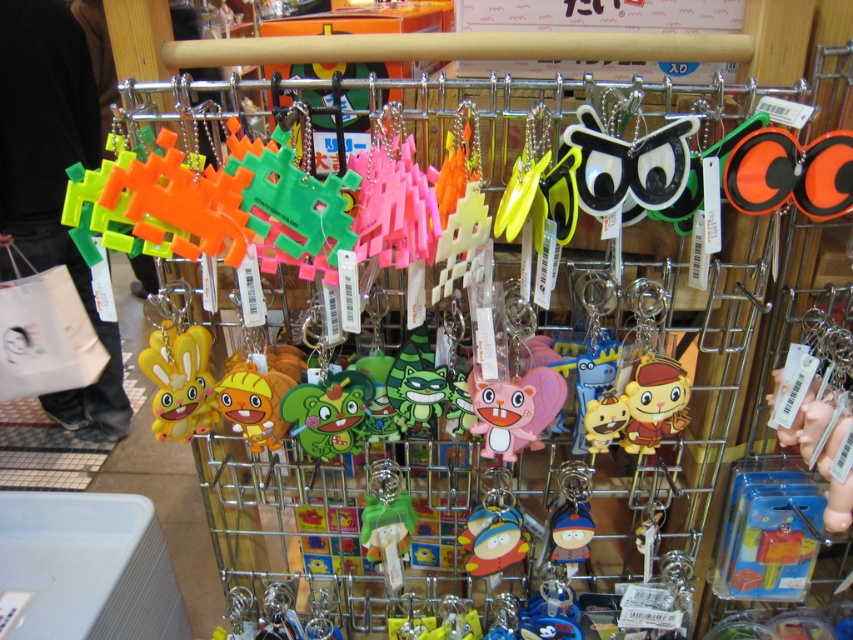
You are a customer in a store looking at the keychain rack. You see the neon plastic keychains at left and the yellow matte rabbit at left. Which one is larger?

The neon plastic keychains at left is bigger than the yellow matte rabbit at left according to the description.

You are a customer browsing the keychains on the metal rack. You notice the neon plastic keychains at left and the pink rubber keychain at center. Which one is placed higher on the rack?

The neon plastic keychains at left is positioned over the pink rubber keychain at center, so it is placed higher on the rack.

You are a customer in the store looking at the rack of keychains. There is a point at coordinates point (51, 179). Can you tell me what this point is located on?

The point (51, 179) is located on the neon plastic keychains at left.